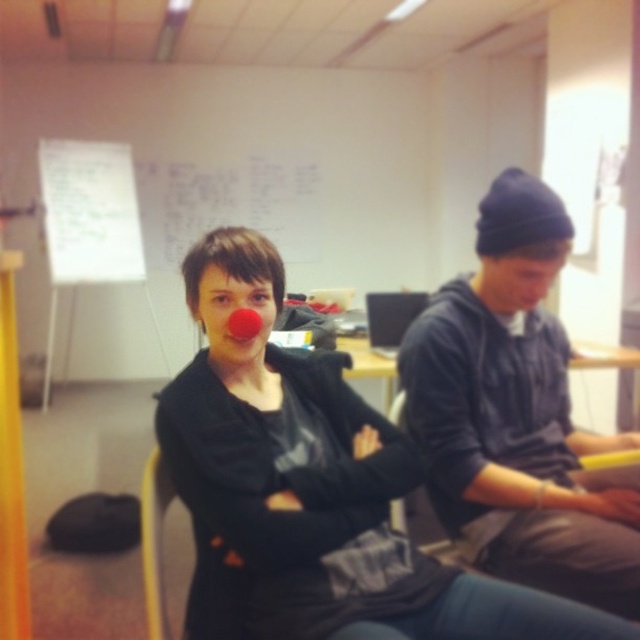
You are a photographer setting up for a group photo in the classroom. You notice the matte black sweater at center and the matte red nose at center. Which object should you adjust to ensure both are centered in the frame?

The matte black sweater at center is to the right of the matte red nose at center. To center both in the frame, adjust the matte black sweater at center to move it further left until it aligns with the matte red nose at center, ensuring both are centered.

You are organizing a photo shoot and need to position a small prop between the matte black sweater at center and the matte black beanie at upper right. Based on their positions, where should you place the prop to ensure it is between them?

The prop should be placed between the matte black sweater at center and the matte black beanie at upper right, positioned to the right of the matte black sweater at center and to the left of the matte black beanie at upper right since the sweater is to the left of the beanie.